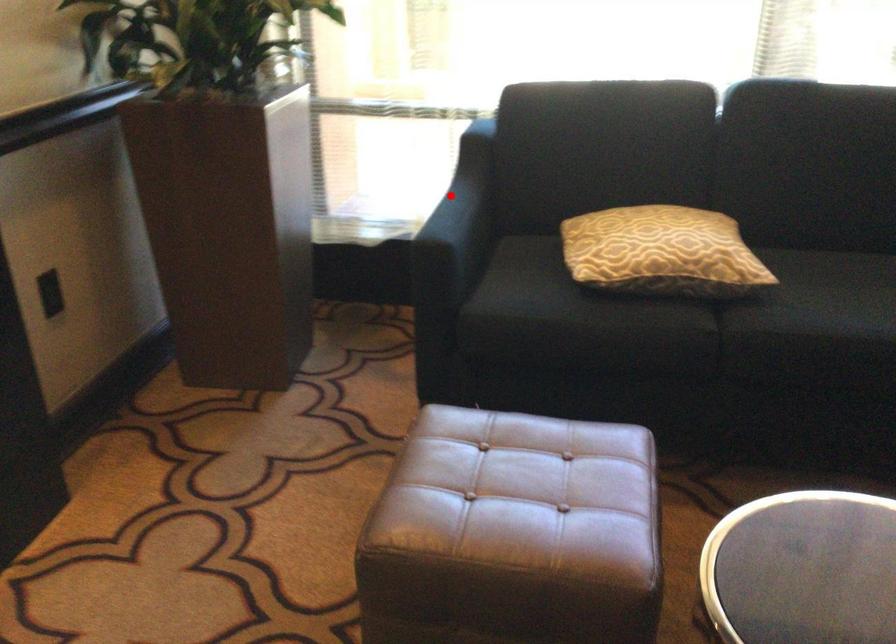
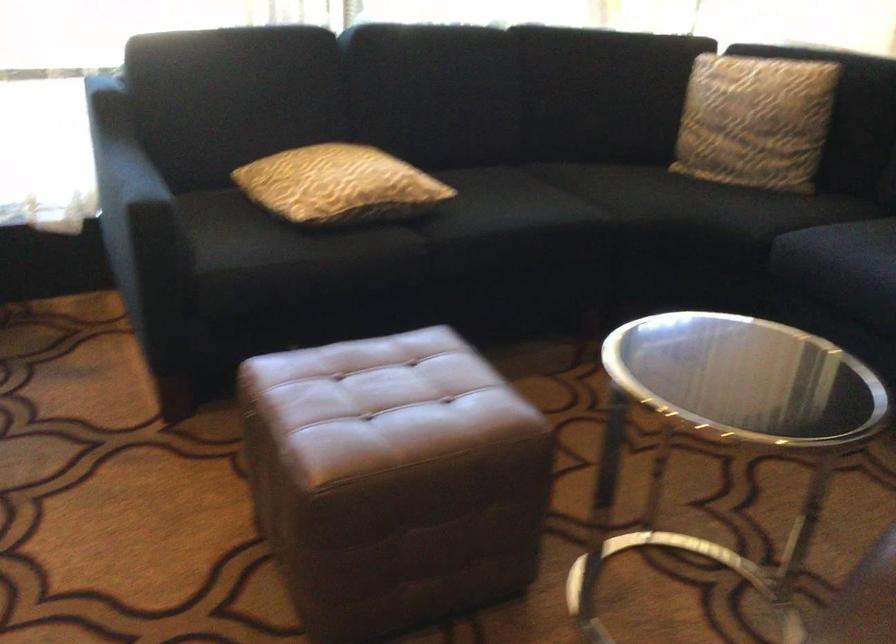
Find the pixel in the second image that matches the highlighted location in the first image.

(118, 162)